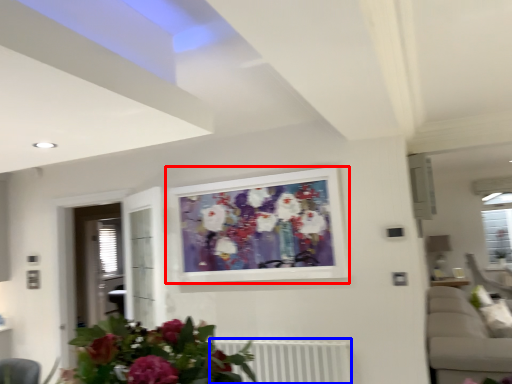
Question: Which object is further to the camera taking this photo, picture frame (highlighted by a red box) or radiator (highlighted by a blue box)?

Choices:
 (A) picture frame
 (B) radiator

Answer: (A)